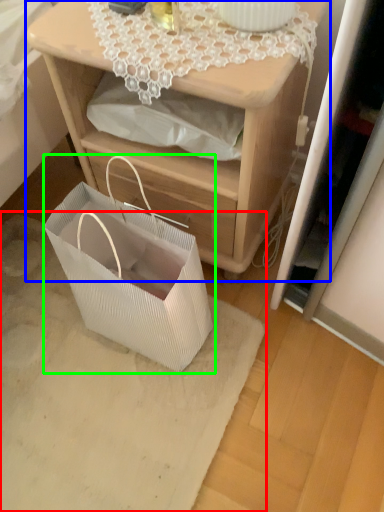
Question: Based on their relative distances, which object is nearer to mat (highlighted by a red box)? Choose from nightstand (highlighted by a blue box) and gift basket (highlighted by a green box).

Choices:
 (A) nightstand
 (B) gift basket

Answer: (B)